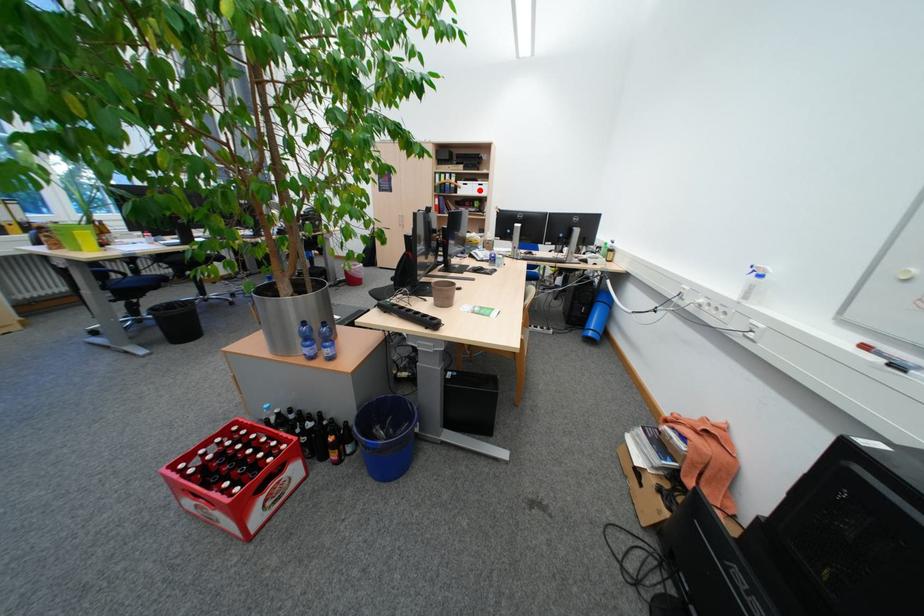
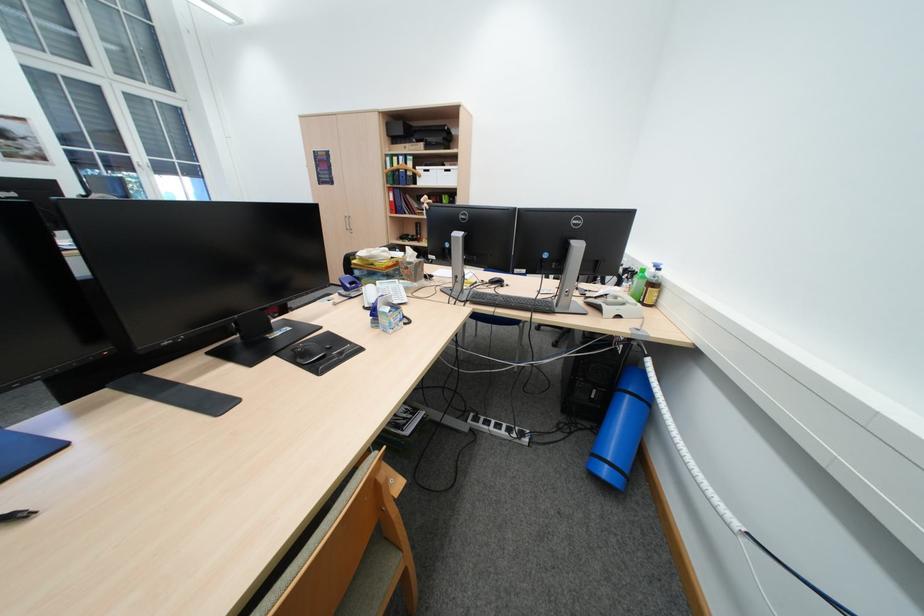
Where in the second image is the point corresponding to the highlighted location from the first image?

(442, 179)